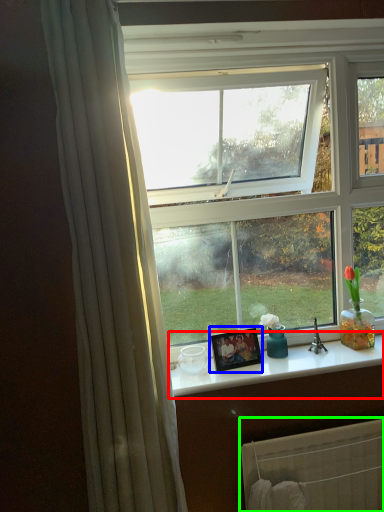
Question: Considering the real-world distances, which object is farthest from counter top (highlighted by a red box)? picture frame (highlighted by a blue box) or radiator (highlighted by a green box)?

Choices:
 (A) picture frame
 (B) radiator

Answer: (B)